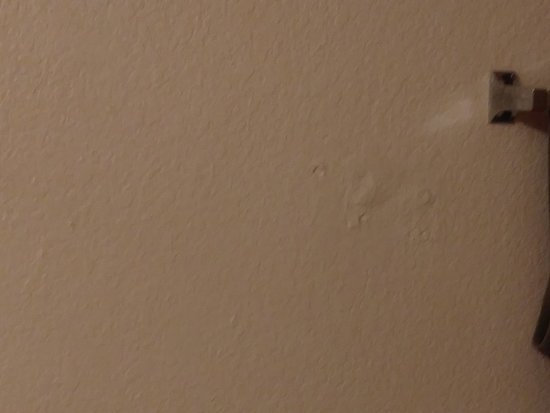
Where is `damage on wall`? damage on wall is located at coordinates (318, 171), (359, 189), (426, 197).